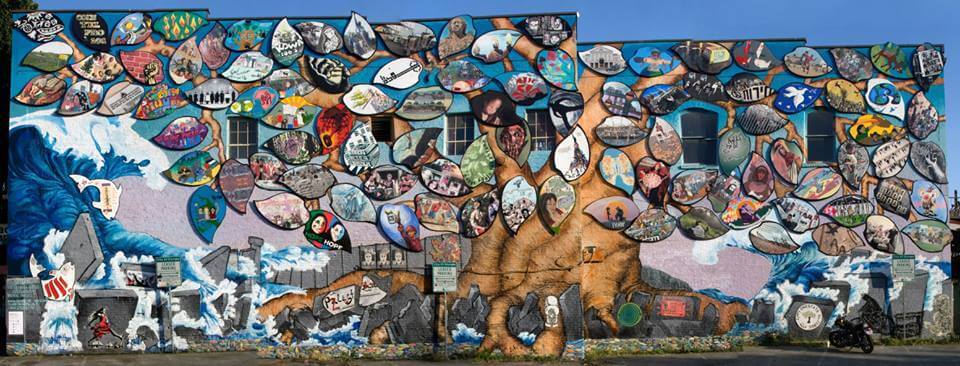
Identify the location of wall. Image resolution: width=960 pixels, height=366 pixels. (156, 215).